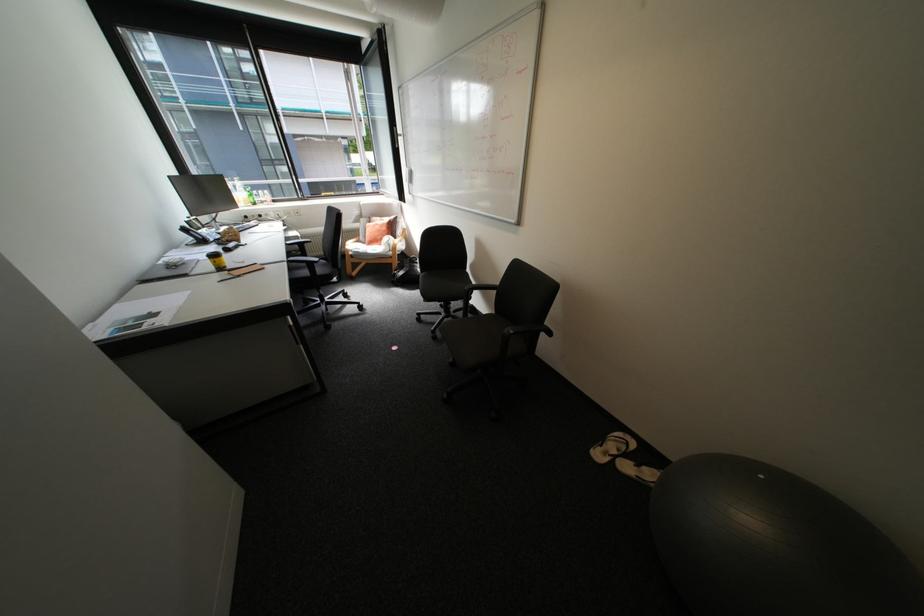
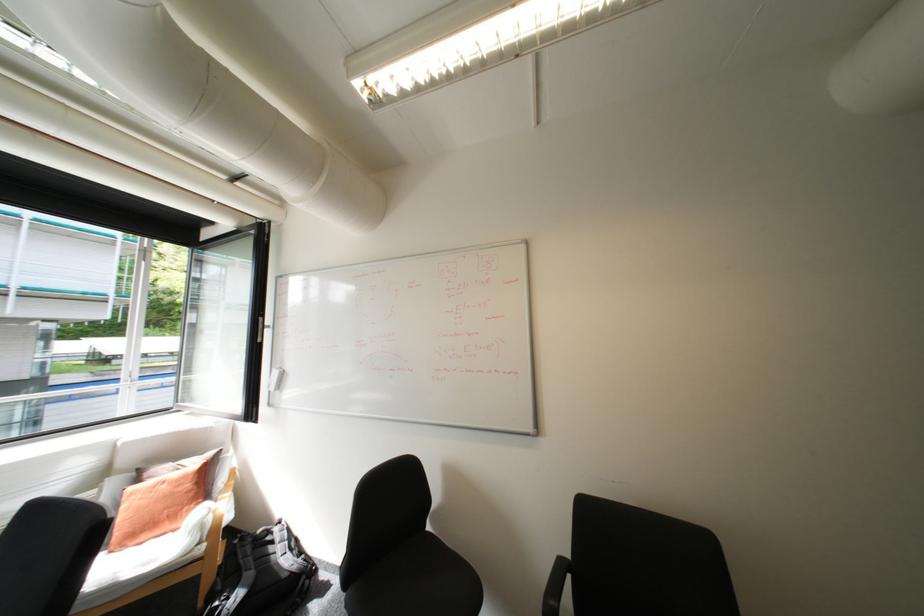
The point at (408, 272) is marked in the first image. Where is the corresponding point in the second image?

(238, 599)